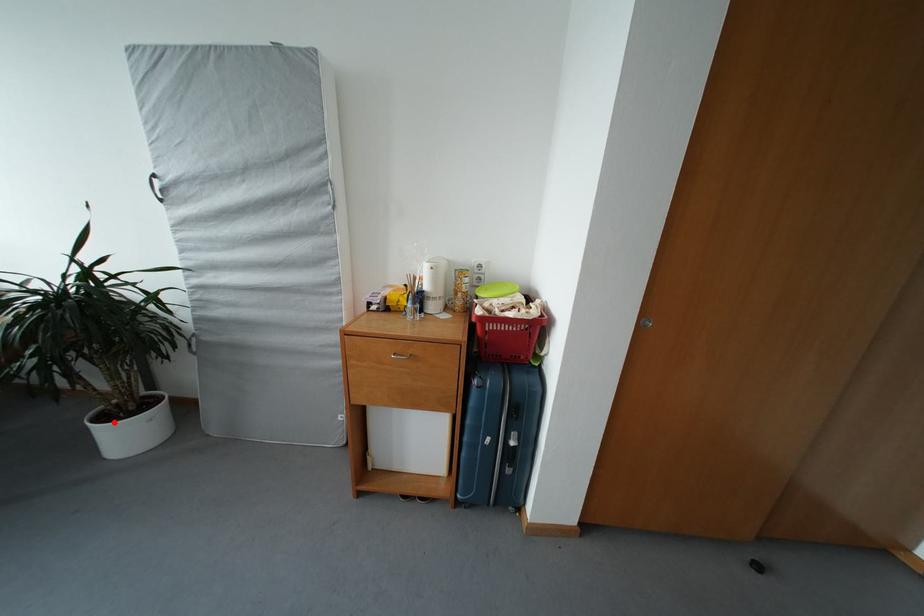
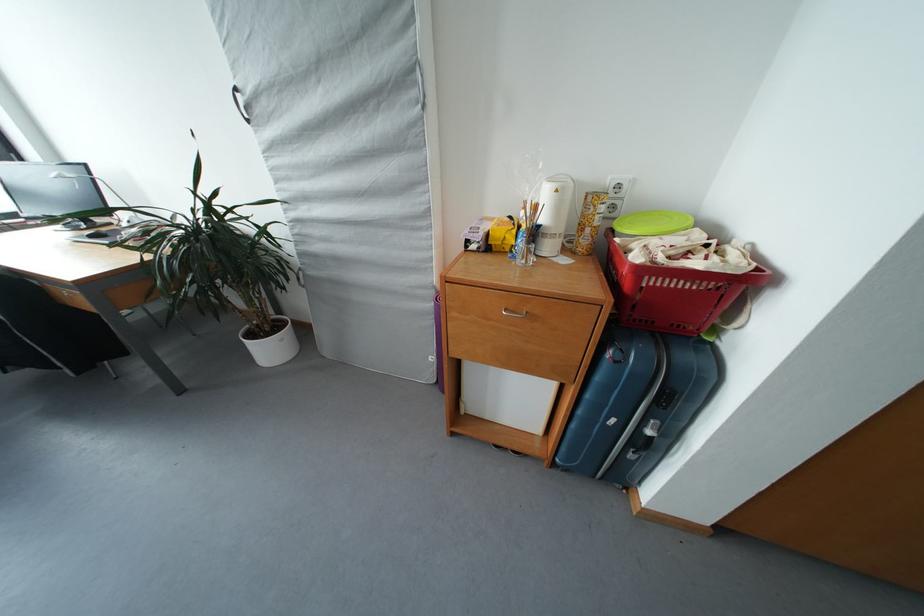
Locate, in the second image, the point that corresponds to the highlighted location in the first image.

(260, 339)